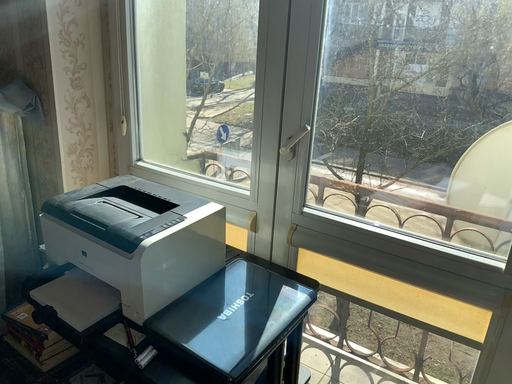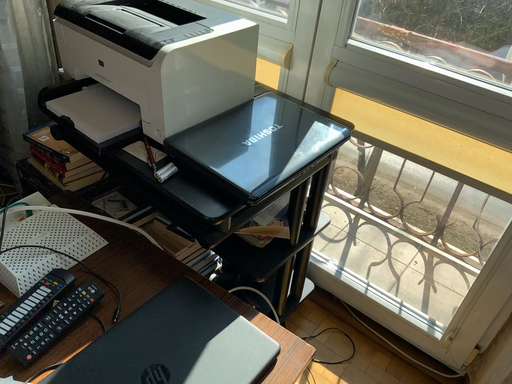
Question: Which way did the camera rotate in the video?

Choices:
 (A) rotated downward
 (B) rotated upward

Answer: (A)